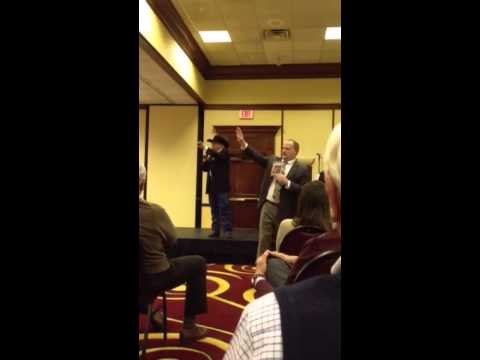
In order to click on chairs in this screenshot , I will do `click(163, 320)`, `click(322, 261)`, `click(297, 232)`.